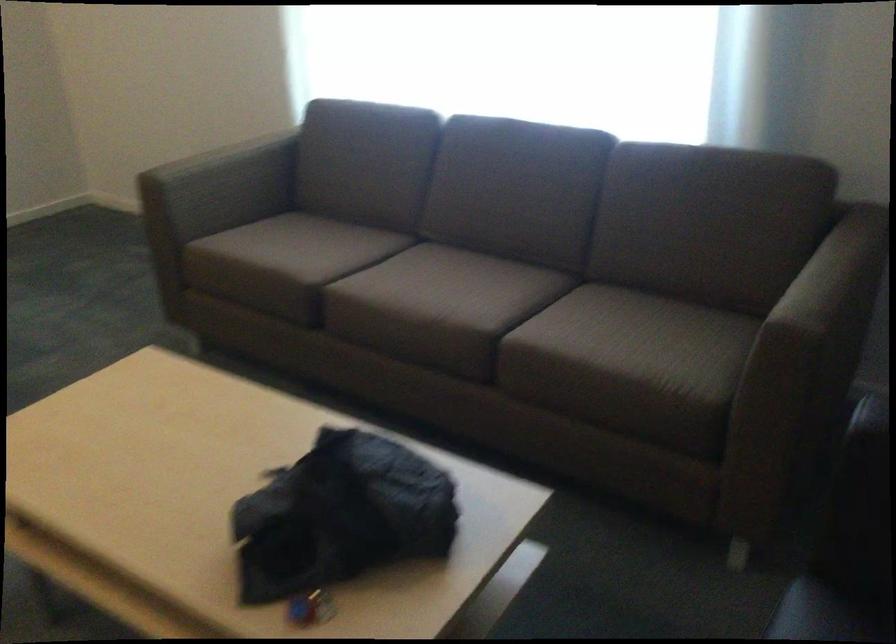
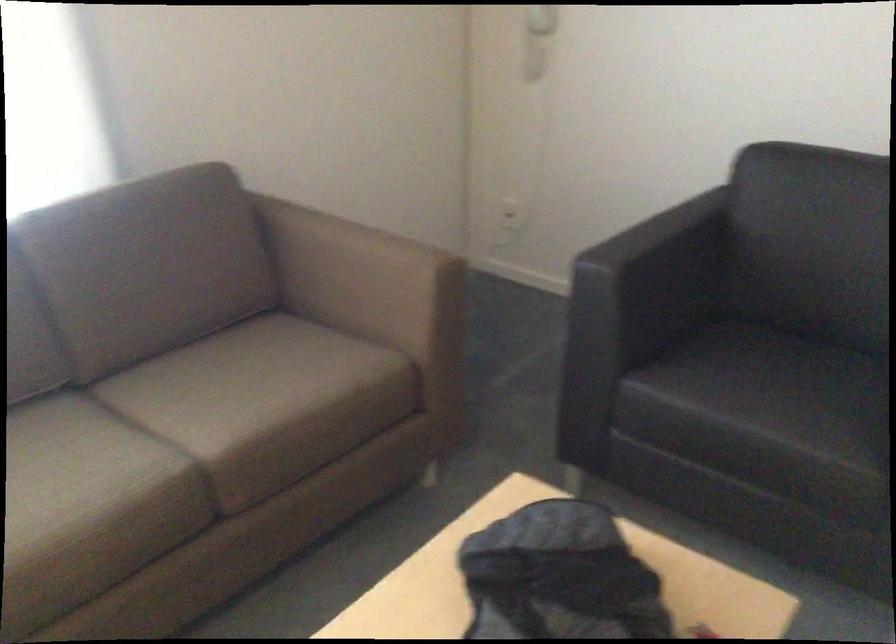
The point at (486, 319) is marked in the first image. Where is the corresponding point in the second image?

(179, 451)